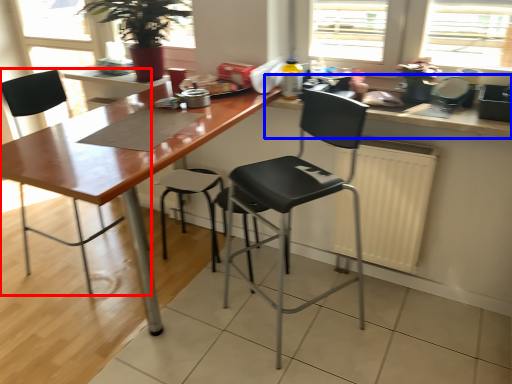
Question: Which object appears closest to the camera in this image, chair (highlighted by a red box) or countertop (highlighted by a blue box)?

Choices:
 (A) chair
 (B) countertop

Answer: (B)